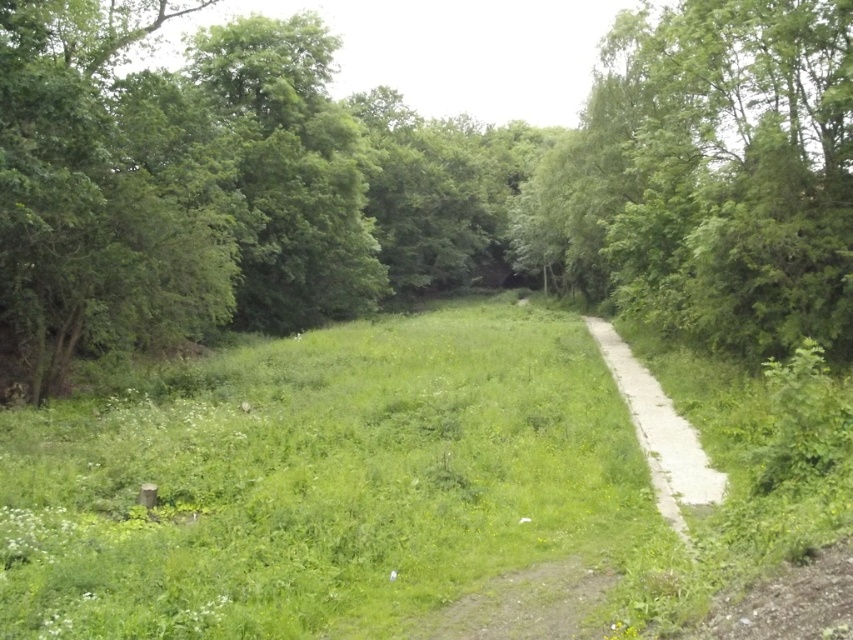
Question: Is green leafy tree at center positioned in front of brown gravel path at center?

Choices:
 (A) yes
 (B) no

Answer: (B)

Question: Does brown gravel path at center lie behind white gravel path at center?

Choices:
 (A) no
 (B) yes

Answer: (A)

Question: Which object is farther from the camera taking this photo?

Choices:
 (A) green leafy tree at center
 (B) white gravel path at center
 (C) brown gravel path at center

Answer: (A)

Question: Is brown gravel path at center to the right of white gravel path at center from the viewer's perspective?

Choices:
 (A) no
 (B) yes

Answer: (A)

Question: Considering the real-world distances, which object is farthest from the brown gravel path at center?

Choices:
 (A) white gravel path at center
 (B) green leafy tree at center

Answer: (B)

Question: Which object appears farthest from the camera in this image?

Choices:
 (A) white gravel path at center
 (B) green leafy tree at center

Answer: (B)